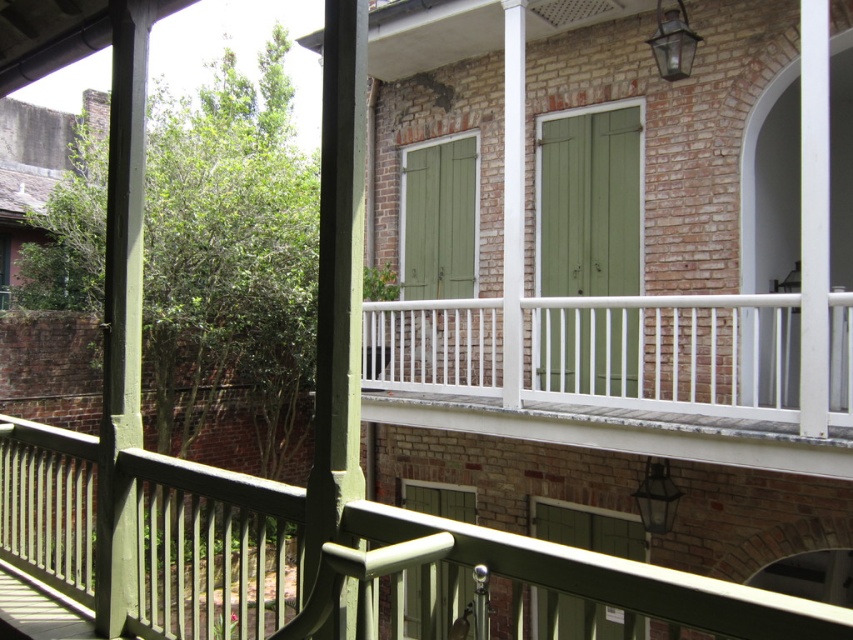
Measure the distance between white matte rail at upper center and white painted wood balustrade at center.

They are 3.81 meters apart.

Who is more forward, (657, 612) or (549, 426)?

Point (657, 612) is in front.

Does point (204, 628) lie behind point (624, 374)?

Yes.

Identify the location of white matte rail at upper center. This screenshot has width=853, height=640. (393, 568).

Which is below, white painted wood balustrade at center or green matte shutters at center?

white painted wood balustrade at center is below.

This screenshot has height=640, width=853. In order to click on white painted wood balustrade at center in this screenshot , I will do `click(616, 374)`.

Which is behind, point (795, 342) or point (538, 168)?

The point (538, 168) is more distant.

Does white painted wood balustrade at center have a greater width compared to green matte door at center?

Yes.

Is point (535, 400) positioned after point (619, 129)?

No, it is in front of (619, 129).

You are a GUI agent. You are given a task and a screenshot of the screen. Output one action in this format:
    pyautogui.click(x=<x>, y=<y>)
    Task: Click on the white painted wood balustrade at center
    Image resolution: width=853 pixels, height=640 pixels.
    Given the screenshot: What is the action you would take?
    pyautogui.click(x=616, y=374)